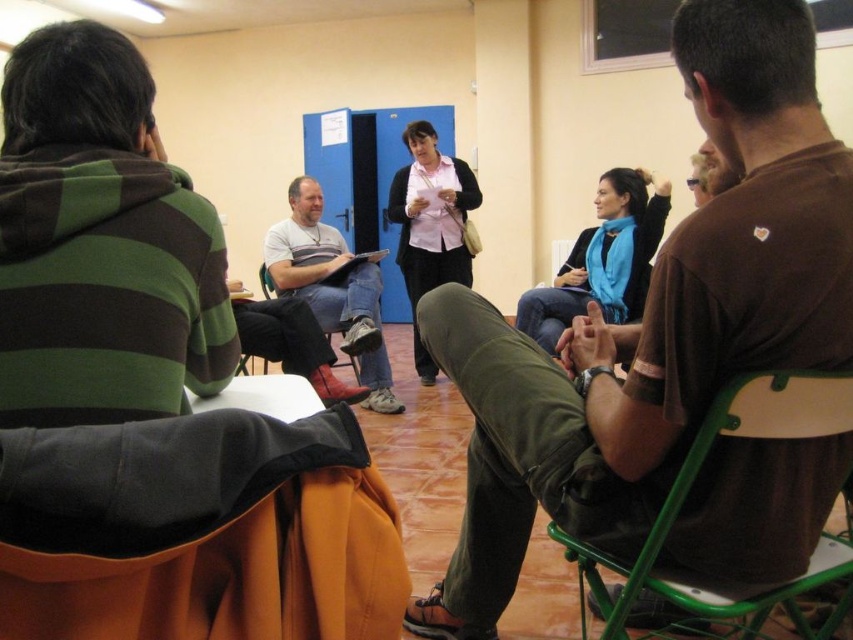
Question: Which object is positioned closest to the brown cotton shirt at center?

Choices:
 (A) matte gray shirt at center
 (B) orange fabric folding chair at lower left

Answer: (B)

Question: Which point is closer to the camera?

Choices:
 (A) (660, 584)
 (B) (306, 317)

Answer: (A)

Question: Is green plastic chair at lower right to the left of wooden folding chair at center from the viewer's perspective?

Choices:
 (A) yes
 (B) no

Answer: (B)

Question: Among these objects, which one is farthest from the camera?

Choices:
 (A) matte gray shirt at center
 (B) brown cotton shirt at center
 (C) orange fabric folding chair at lower left

Answer: (A)

Question: Does orange fabric folding chair at lower left have a greater width compared to matte gray shirt at center?

Choices:
 (A) no
 (B) yes

Answer: (A)

Question: Is brown cotton shirt at center bigger than orange fabric folding chair at lower left?

Choices:
 (A) yes
 (B) no

Answer: (A)